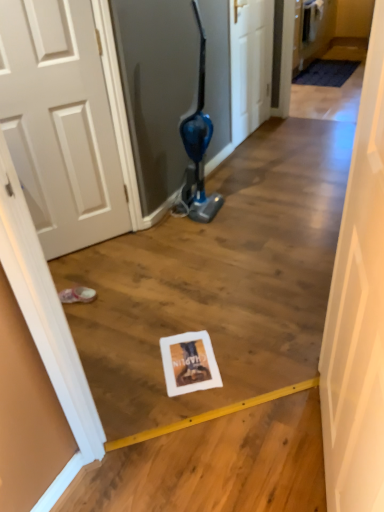
Identify the location of white matte door at center, which ranks as the first door in front-to-back order. (358, 312).

Where is `white matte door at center, the second door from the back`? This screenshot has height=512, width=384. white matte door at center, the second door from the back is located at coordinates (358, 312).

Does point (328, 344) lie behind point (232, 30)?

No, (328, 344) is closer to viewer.

Is white matte door at center, which is the second door from top to bottom, positioned in front of white wood door at center, acting as the 1th door starting from the top?

Yes, white matte door at center, which is the second door from top to bottom, is closer to the viewer.

Is white matte door at center, the second door from the back, wider or thinner than white wood door at center, acting as the 1th door starting from the top?

Clearly, white matte door at center, the second door from the back, has more width compared to white wood door at center, acting as the 1th door starting from the top.

Between pink fabric footwear at lower left and white matte door at center, the first door in the bottom-to-top sequence, which one has smaller size?

pink fabric footwear at lower left.

Is pink fabric footwear at lower left next to white matte door at center, the first door in the bottom-to-top sequence?

There is a gap between pink fabric footwear at lower left and white matte door at center, the first door in the bottom-to-top sequence.

How different are the orientations of pink fabric footwear at lower left and white matte door at center, the first door in the bottom-to-top sequence, in degrees?

The angular difference between pink fabric footwear at lower left and white matte door at center, the first door in the bottom-to-top sequence, is 81.1 degrees.

Which point is more forward, (91, 298) or (248, 49)?

The point (91, 298) is more forward.

How distant is pink fabric footwear at lower left from white wood door at center, the second door when ordered from bottom to top?

2.22 meters.

Would you say pink fabric footwear at lower left is a long distance from white wood door at center, placed as the first door when sorted from back to front?

Yes, pink fabric footwear at lower left is far from white wood door at center, placed as the first door when sorted from back to front.

Considering the sizes of objects pink fabric footwear at lower left and white wood door at center, acting as the 1th door starting from the top, in the image provided, who is smaller, pink fabric footwear at lower left or white wood door at center, acting as the 1th door starting from the top,?

pink fabric footwear at lower left is smaller.

Is white wood door at center, which appears as the 2th door when viewed from the front, aimed at white matte door at center, which is the second door from top to bottom?

No, white wood door at center, which appears as the 2th door when viewed from the front, is not turned towards white matte door at center, which is the second door from top to bottom.

From a real-world perspective, is white wood door at center, placed as the first door when sorted from back to front, positioned above or below white matte door at center, which is the second door from top to bottom?

white wood door at center, placed as the first door when sorted from back to front, is situated lower than white matte door at center, which is the second door from top to bottom, in the real world.

From the image's perspective, between white wood door at center, which appears as the 2th door when viewed from the front, and white matte door at center, which ranks as the first door in front-to-back order, which one is located above?

white wood door at center, which appears as the 2th door when viewed from the front, appears higher in the image.

Identify the location of door on the left side of white wood door at center, which appears as the 2th door when viewed from the front. (358, 312).

You are a GUI agent. You are given a task and a screenshot of the screen. Output one action in this format:
    pyautogui.click(x=<x>, y=<y>)
    Task: Click on the door that is the 2nd one above the pink fabric footwear at lower left (from a real-world perspective)
    
    Given the screenshot: What is the action you would take?
    pyautogui.click(x=358, y=312)

Considering the relative sizes of white matte door at center, which is the second door from top to bottom, and pink fabric footwear at lower left in the image provided, is white matte door at center, which is the second door from top to bottom, wider than pink fabric footwear at lower left?

No, white matte door at center, which is the second door from top to bottom, is not wider than pink fabric footwear at lower left.

From the image's perspective, is white matte door at center, which ranks as the first door in front-to-back order, positioned above or below pink fabric footwear at lower left?

white matte door at center, which ranks as the first door in front-to-back order, is situated lower than pink fabric footwear at lower left in the image.

Based on the photo, can you confirm if white matte door at center, the second door from the back, is positioned to the right of pink fabric footwear at lower left?

Indeed, white matte door at center, the second door from the back, is positioned on the right side of pink fabric footwear at lower left.

Is white wood door at center, placed as the first door when sorted from back to front, facing away from pink fabric footwear at lower left?

No, white wood door at center, placed as the first door when sorted from back to front,'s orientation is not away from pink fabric footwear at lower left.

Is white wood door at center, acting as the 1th door starting from the top, in front of pink fabric footwear at lower left?

That is False.

Where is `door located underneath the white matte door at center, the second door from the back (from a real-world perspective)`? The width and height of the screenshot is (384, 512). door located underneath the white matte door at center, the second door from the back (from a real-world perspective) is located at coordinates (250, 65).

The image size is (384, 512). Find the location of `footwear on the left of white matte door at center, the first door in the bottom-to-top sequence`. footwear on the left of white matte door at center, the first door in the bottom-to-top sequence is located at coordinates (77, 295).

Estimate the real-world distances between objects in this image. Which object is further from white wood door at center, placed as the first door when sorted from back to front, pink fabric footwear at lower left or white matte door at center, the first door in the bottom-to-top sequence?

The object further to white wood door at center, placed as the first door when sorted from back to front, is white matte door at center, the first door in the bottom-to-top sequence.

Consider the image. Based on their spatial positions, is white matte door at center, which is the second door from top to bottom, or white wood door at center, acting as the 1th door starting from the top, closer to pink fabric footwear at lower left?

white matte door at center, which is the second door from top to bottom, is closer to pink fabric footwear at lower left.

When comparing their distances from white wood door at center, the second door when ordered from bottom to top, does white matte door at center, which is the second door from top to bottom, or pink fabric footwear at lower left seem closer?

pink fabric footwear at lower left is closer to white wood door at center, the second door when ordered from bottom to top.

When comparing their distances from white matte door at center, the first door in the bottom-to-top sequence, does white wood door at center, acting as the 1th door starting from the top, or pink fabric footwear at lower left seem closer?

pink fabric footwear at lower left lies closer to white matte door at center, the first door in the bottom-to-top sequence, than the other object.

Looking at the image, which one is located closer to pink fabric footwear at lower left, white wood door at center, which appears as the 2th door when viewed from the front, or white matte door at center, which is the second door from top to bottom?

white matte door at center, which is the second door from top to bottom, is positioned closer to the anchor pink fabric footwear at lower left.

When comparing their distances from white matte door at center, the second door from the back, does pink fabric footwear at lower left or white wood door at center, which appears as the 2th door when viewed from the front, seem closer?

pink fabric footwear at lower left lies closer to white matte door at center, the second door from the back, than the other object.

The width and height of the screenshot is (384, 512). I want to click on footwear between white matte door at center, the first door in the bottom-to-top sequence, and white wood door at center, acting as the 1th door starting from the top, along the z-axis, so click(77, 295).